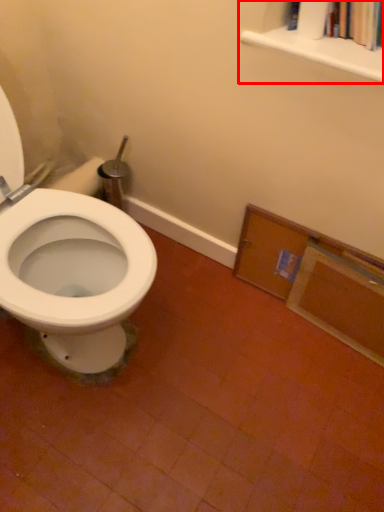
Question: From the image, what is the correct spatial relationship of bookcase (annotated by the red box) in relation to medicine cabinet?

Choices:
 (A) left
 (B) right

Answer: (B)